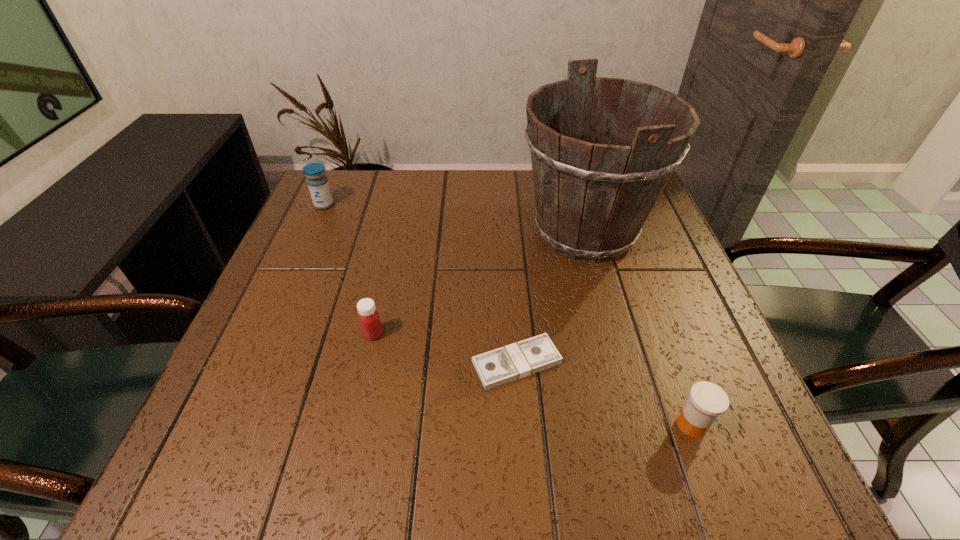
This screenshot has height=540, width=960. In order to click on medicine present at the right edge in this screenshot , I will do `click(707, 401)`.

The width and height of the screenshot is (960, 540). Find the location of `object that is at the far left corner`. object that is at the far left corner is located at coordinates (318, 184).

Identify the location of object positioned at the far right corner. The image size is (960, 540). point(592,199).

You are a GUI agent. You are given a task and a screenshot of the screen. Output one action in this format:
    pyautogui.click(x=<x>, y=<y>)
    Task: Click on the object located in the near right corner section of the desktop
    The height and width of the screenshot is (540, 960).
    Given the screenshot: What is the action you would take?
    pyautogui.click(x=707, y=401)

You are a GUI agent. You are given a task and a screenshot of the screen. Output one action in this format:
    pyautogui.click(x=<x>, y=<y>)
    Task: Click on the vacant region at the far edge of the desktop
    
    Given the screenshot: What is the action you would take?
    pyautogui.click(x=525, y=213)

Identify the location of free space at the near edge of the desktop. The image size is (960, 540). (458, 478).

The image size is (960, 540). In the image, there is a desktop. What are the coordinates of `vacant area at the left edge` in the screenshot? It's located at (305, 238).

The width and height of the screenshot is (960, 540). I want to click on vacant space at the right edge of the desktop, so click(619, 271).

Identify the location of free space at the far left corner of the desktop. Image resolution: width=960 pixels, height=540 pixels. (309, 205).

Find the location of a particular element. The image size is (960, 540). free space between the second tallest object and the dollar is located at coordinates click(420, 284).